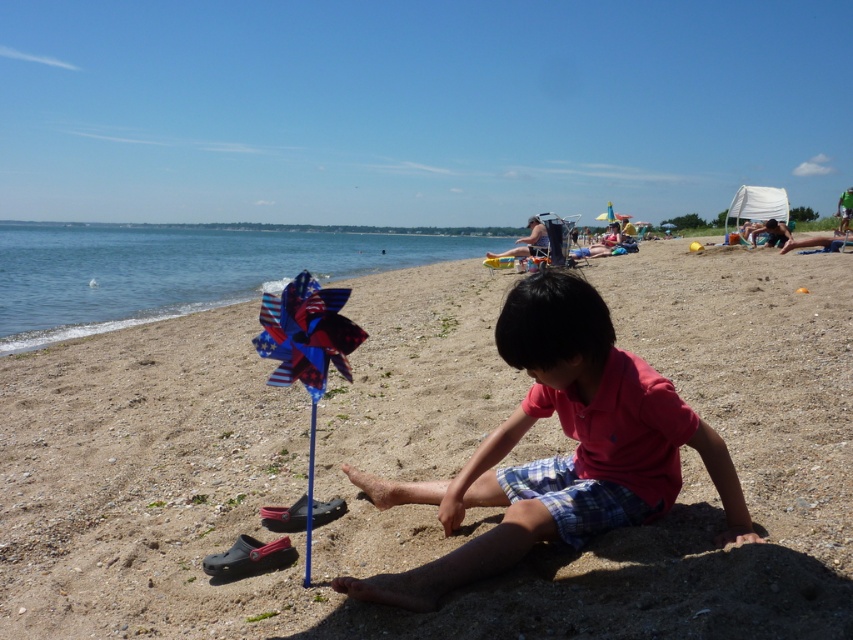
Consider the image. Which of these two, smooth sand at center or pink cotton shirt at center, stands taller?

smooth sand at center

What do you see at coordinates (428, 461) in the screenshot? The image size is (853, 640). I see `smooth sand at center` at bounding box center [428, 461].

Locate an element on the screen. Image resolution: width=853 pixels, height=640 pixels. smooth sand at center is located at coordinates (428, 461).

Which is above, pink cotton shirt at center or american flag pinwheel at center?

Positioned higher is american flag pinwheel at center.

Who is taller, pink cotton shirt at center or american flag pinwheel at center?

Standing taller between the two is pink cotton shirt at center.

Between point (419, 586) and point (277, 336), which one is positioned in front?

Positioned in front is point (419, 586).

At what (x,y) coordinates should I click in order to perform the action: click on pink cotton shirt at center. Please return your answer as a coordinate pair (x, y). Looking at the image, I should click on (560, 456).

Can you confirm if smooth sand at center is wider than american flag pinwheel at center?

Answer: Correct, the width of smooth sand at center exceeds that of american flag pinwheel at center.

Can you confirm if smooth sand at center is positioned above american flag pinwheel at center?

Yes.

You are a GUI agent. You are given a task and a screenshot of the screen. Output one action in this format:
    pyautogui.click(x=<x>, y=<y>)
    Task: Click on the smooth sand at center
    Image resolution: width=853 pixels, height=640 pixels.
    Given the screenshot: What is the action you would take?
    pyautogui.click(x=428, y=461)